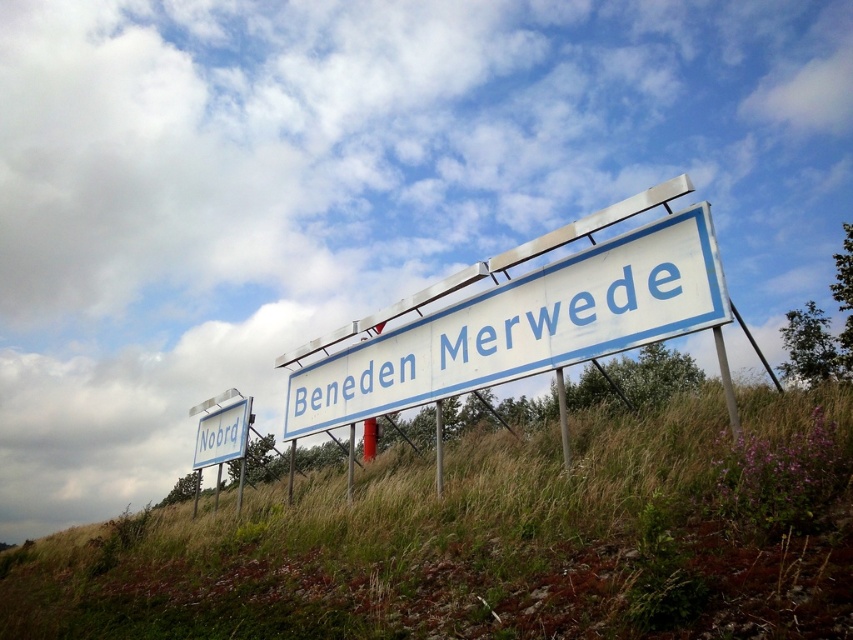
Question: Can you confirm if green grassy at lower center is positioned to the right of white plastic sign at lower left?

Choices:
 (A) no
 (B) yes

Answer: (B)

Question: Which of the following is the closest to the observer?

Choices:
 (A) (438, 388)
 (B) (554, 481)

Answer: (B)

Question: Among these objects, which one is farthest from the camera?

Choices:
 (A) white plastic sign at lower left
 (B) white plastic sign at center
 (C) green grassy at lower center

Answer: (A)

Question: Is white plastic sign at center to the left of white plastic sign at lower left from the viewer's perspective?

Choices:
 (A) no
 (B) yes

Answer: (A)

Question: Can you confirm if green grassy at lower center is positioned to the right of white plastic sign at lower left?

Choices:
 (A) yes
 (B) no

Answer: (A)

Question: Which of these objects is positioned farthest from the white plastic sign at lower left?

Choices:
 (A) green grassy at lower center
 (B) white plastic sign at center

Answer: (B)